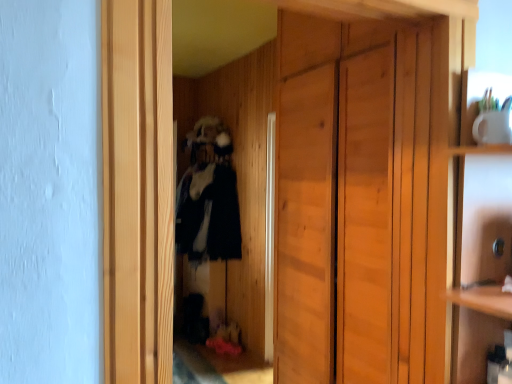
The width and height of the screenshot is (512, 384). Describe the element at coordinates (360, 201) in the screenshot. I see `wooden wardrobe at center` at that location.

The height and width of the screenshot is (384, 512). Find the location of `wooden wardrobe at center`. wooden wardrobe at center is located at coordinates (360, 201).

The width and height of the screenshot is (512, 384). What are the coordinates of `wooden wardrobe at center` in the screenshot? It's located at (360, 201).